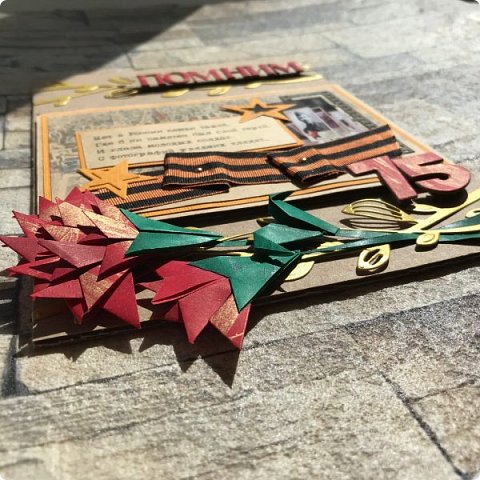
What are the coordinates of `artwork` in the screenshot? It's located at (238, 203).